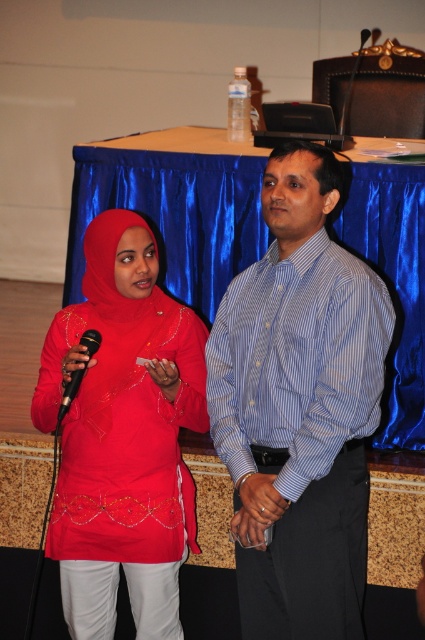
Question: Does blue striped shirt at center appear over matte red dress at center?

Choices:
 (A) no
 (B) yes

Answer: (B)

Question: Can you confirm if blue striped shirt at center is positioned below matte red dress at center?

Choices:
 (A) no
 (B) yes

Answer: (A)

Question: Which of these objects is positioned closest to the black plastic microphone at left?

Choices:
 (A) matte red dress at center
 (B) blue striped shirt at center

Answer: (A)

Question: Which object is closer to the camera taking this photo?

Choices:
 (A) black plastic microphone at left
 (B) blue striped shirt at center
 (C) matte red dress at center

Answer: (B)

Question: Which object appears farthest from the camera in this image?

Choices:
 (A) black plastic microphone at left
 (B) blue striped shirt at center
 (C) matte red dress at center

Answer: (C)

Question: Where is blue striped shirt at center located in relation to matte red dress at center in the image?

Choices:
 (A) left
 (B) right

Answer: (B)